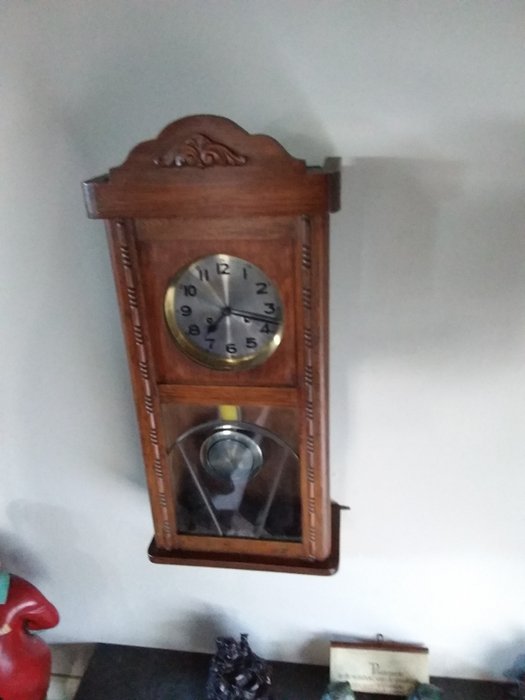
Where is `statue`? The image size is (525, 700). statue is located at coordinates (231, 673).